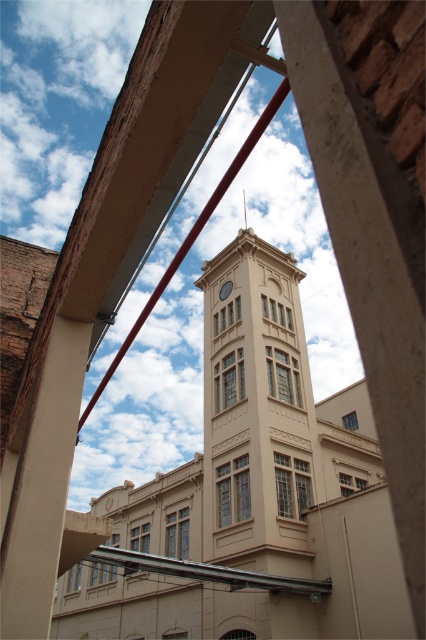
Which is behind, point (221, 289) or point (247, 221)?

The point (247, 221) is behind.

Is metallic clock at center closer to camera compared to smooth silver spire at upper center?

Yes.

Locate an element on the screen. The height and width of the screenshot is (640, 426). metallic clock at center is located at coordinates (224, 289).

Which is in front, point (302, 522) or point (245, 216)?

Positioned in front is point (302, 522).

Is point (328, 496) farther from camera compared to point (244, 195)?

No, (328, 496) is closer to viewer.

Image resolution: width=426 pixels, height=640 pixels. Identify the location of beige stone clock tower at center. (256, 417).

This screenshot has width=426, height=640. I want to click on beige stone clock tower at center, so click(256, 417).

Who is positioned more to the left, beige stone clock tower at center or metallic clock at center?

From the viewer's perspective, metallic clock at center appears more on the left side.

I want to click on beige stone clock tower at center, so (x=256, y=417).

Locate an element on the screen. Image resolution: width=426 pixels, height=640 pixels. beige stone clock tower at center is located at coordinates (256, 417).